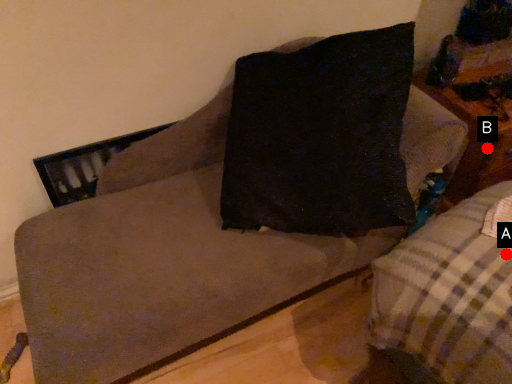
Question: Two points are circled on the image, labeled by A and B beside each circle. Which point is closer to the camera?

Choices:
 (A) A is closer
 (B) B is closer

Answer: (A)